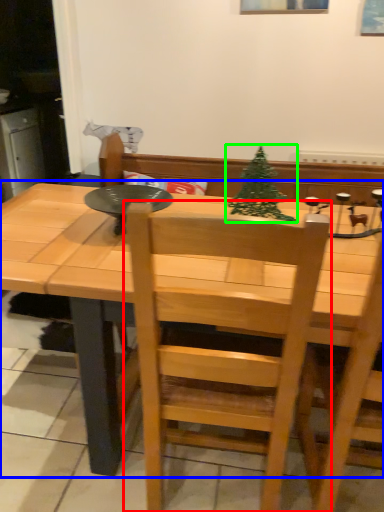
Question: Which object is the farthest from chair (highlighted by a red box)? Choose among these: table (highlighted by a blue box) or christmas tree (highlighted by a green box).

Choices:
 (A) table
 (B) christmas tree

Answer: (B)